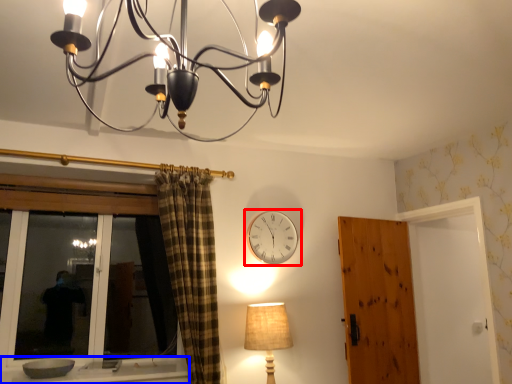
Question: Which object is further to the camera taking this photo, wall clock (highlighted by a red box) or window sill (highlighted by a blue box)?

Choices:
 (A) wall clock
 (B) window sill

Answer: (A)